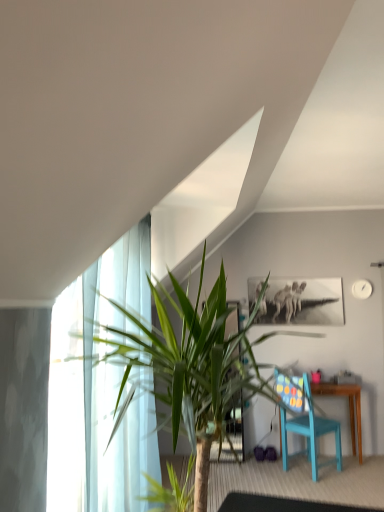
Question: From a real-world perspective, relative to green leafy plant at left, is matte blue chair at lower right vertically above or below?

Choices:
 (A) above
 (B) below

Answer: (B)

Question: From the image's perspective, is matte blue chair at lower right positioned above or below green leafy plant at left?

Choices:
 (A) below
 (B) above

Answer: (A)

Question: Which is farther from the matte blue chair at lower right?

Choices:
 (A) green leafy plant at left
 (B) transparent glass table at lower center

Answer: (A)

Question: Which object is the farthest from the green leafy plant at left?

Choices:
 (A) transparent glass table at lower center
 (B) matte blue chair at lower right

Answer: (B)